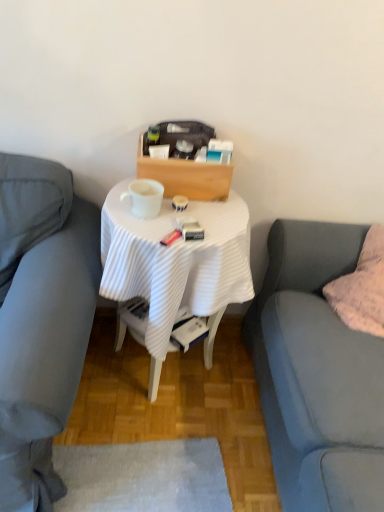
Where is `vacant space that's between white ribbed cloth at center and soft gray fabric couch at right, the second studio couch in the left-to-right sequence`? This screenshot has width=384, height=512. vacant space that's between white ribbed cloth at center and soft gray fabric couch at right, the second studio couch in the left-to-right sequence is located at coordinates [x=191, y=460].